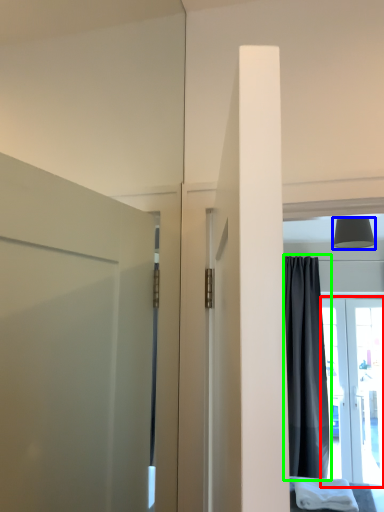
Question: Based on their relative distances, which object is farther from door (highlighted by a red box)? Choose from lamp (highlighted by a blue box) and curtain (highlighted by a green box).

Choices:
 (A) lamp
 (B) curtain

Answer: (A)